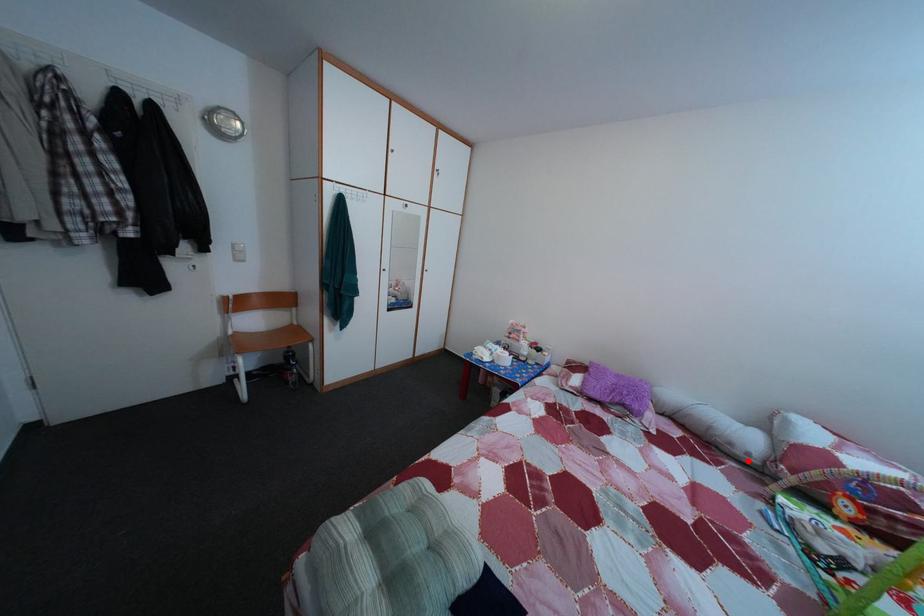
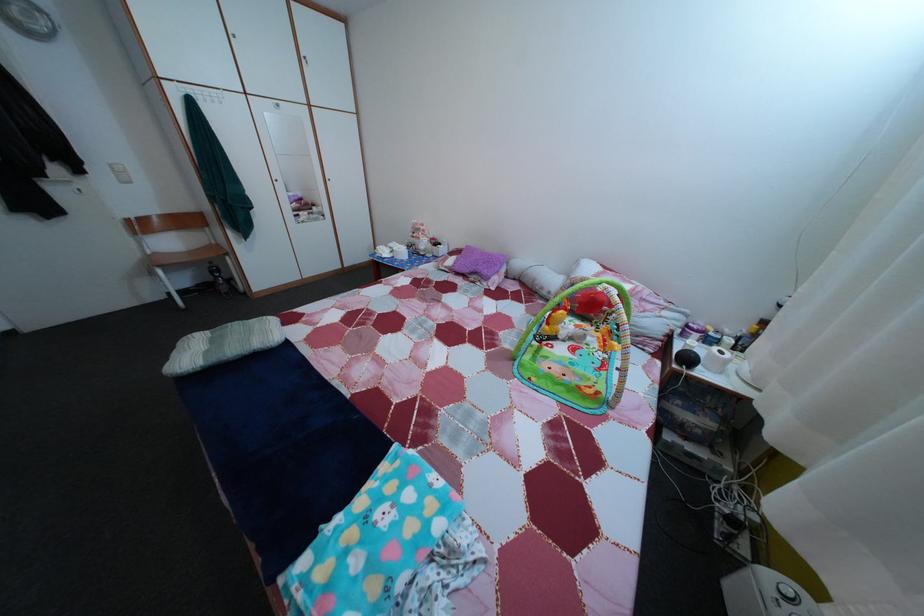
Question: I am providing you with two images of the same scene from different viewpoints. In image1, a red point is highlighted. Considering the same 3D point in image2, which of the following is correct?

Choices:
 (A) It is closer
 (B) It is farther

Answer: (A)